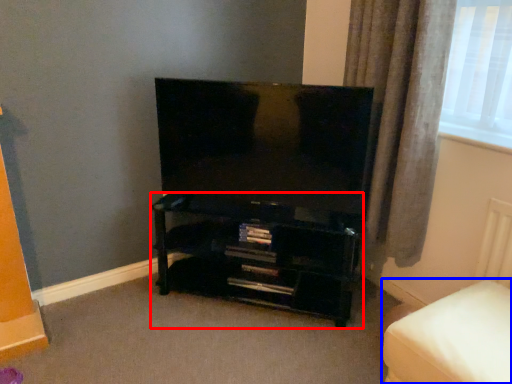
Question: Which object is closer to the camera taking this photo, shelf (highlighted by a red box) or furniture (highlighted by a blue box)?

Choices:
 (A) shelf
 (B) furniture

Answer: (B)